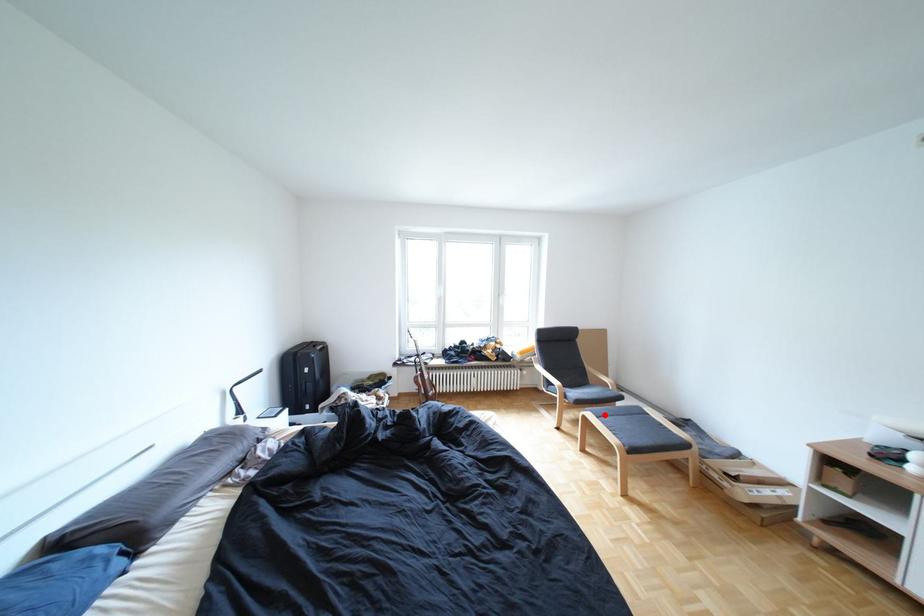
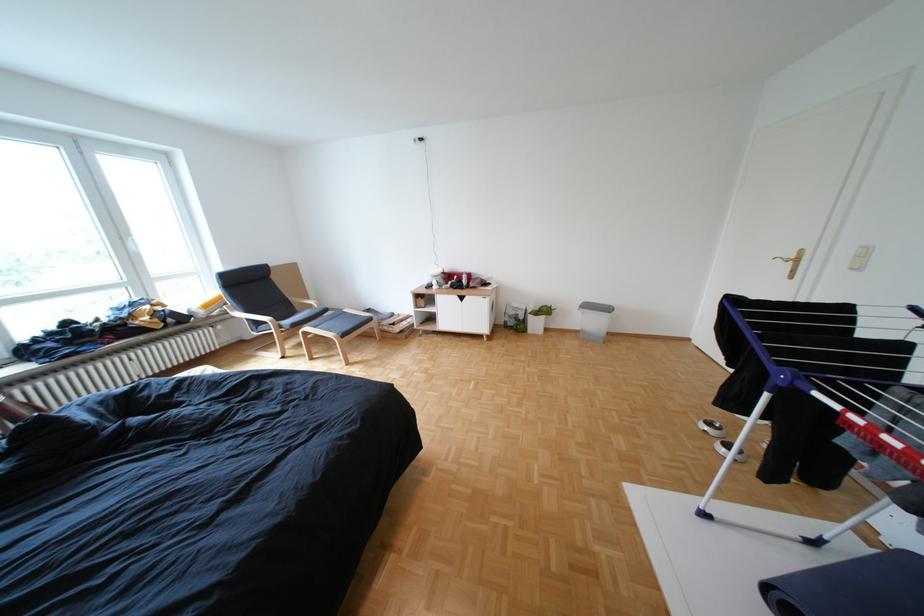
Find the pixel in the second image that matches the highlighted location in the first image.

(322, 329)